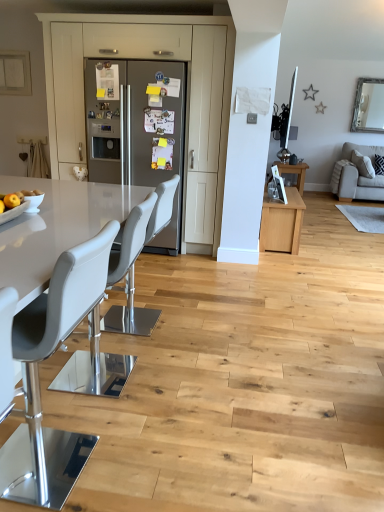
The image size is (384, 512). Find the location of `vacant space that is in between white leather chair at center, the 1th chair viewed from the back, and gray leather bar stool at center, the second chair from the front`. vacant space that is in between white leather chair at center, the 1th chair viewed from the back, and gray leather bar stool at center, the second chair from the front is located at coordinates click(x=133, y=346).